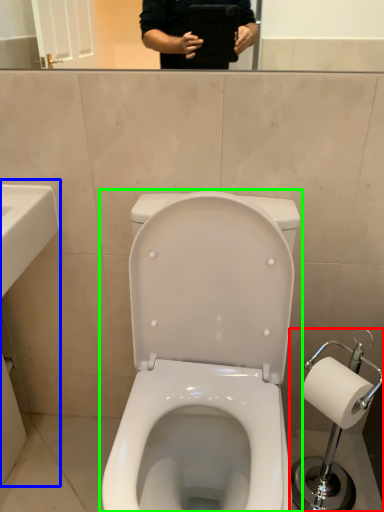
Question: Based on their relative distances, which object is farther from scale (highlighted by a red box)? Choose from sink (highlighted by a blue box) and toilet (highlighted by a green box).

Choices:
 (A) sink
 (B) toilet

Answer: (A)